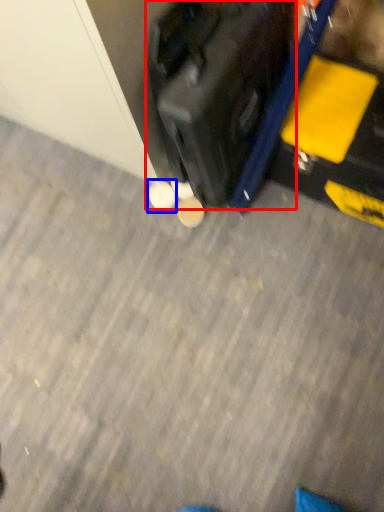
Question: Which object is closer to the camera taking this photo, suitcase (highlighted by a red box) or footwear (highlighted by a blue box)?

Choices:
 (A) suitcase
 (B) footwear

Answer: (A)